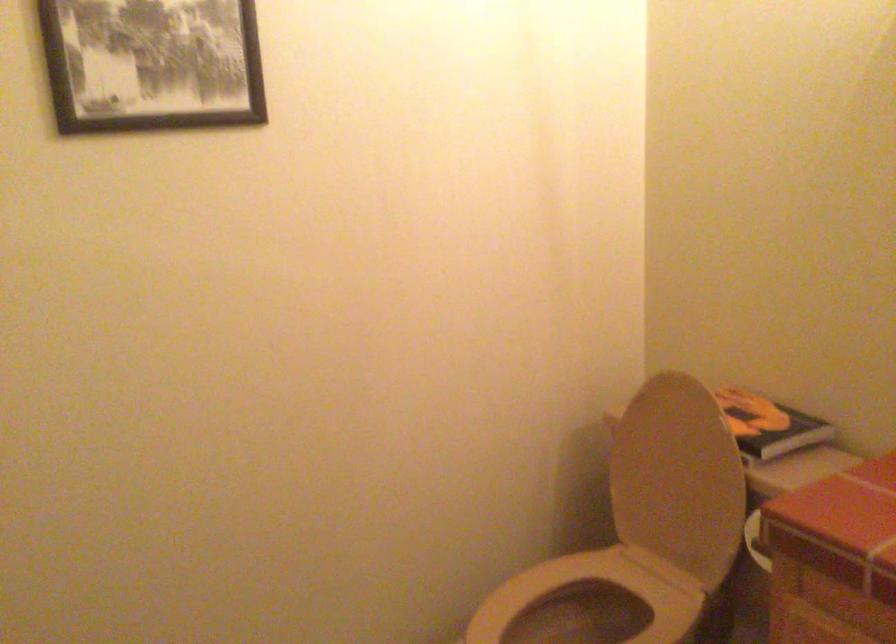
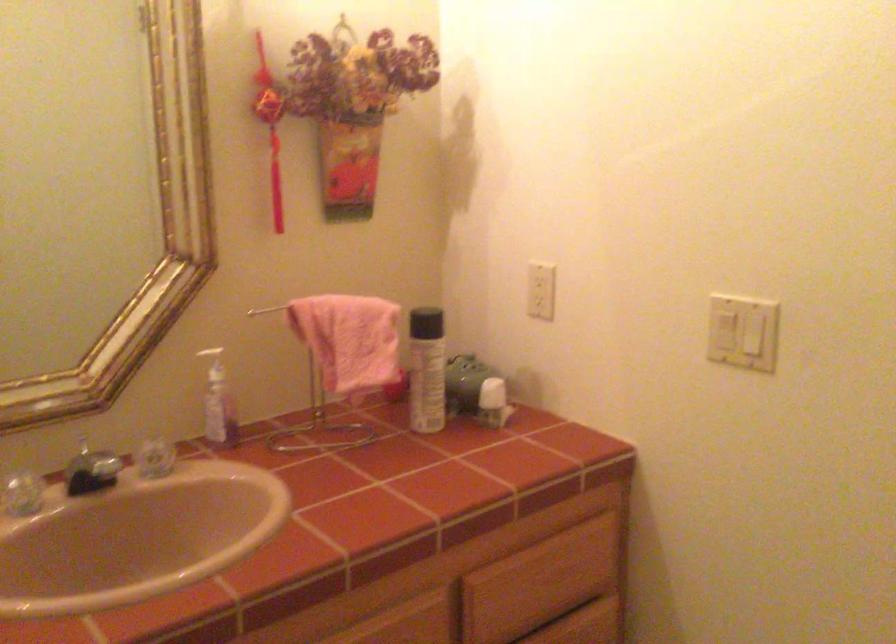
Question: The camera is either moving clockwise (left) or counter-clockwise (right) around the object. The first image is from the beginning of the video and the second image is from the end. Is the camera moving left or right when shooting the video?

Choices:
 (A) Left
 (B) Right

Answer: (A)